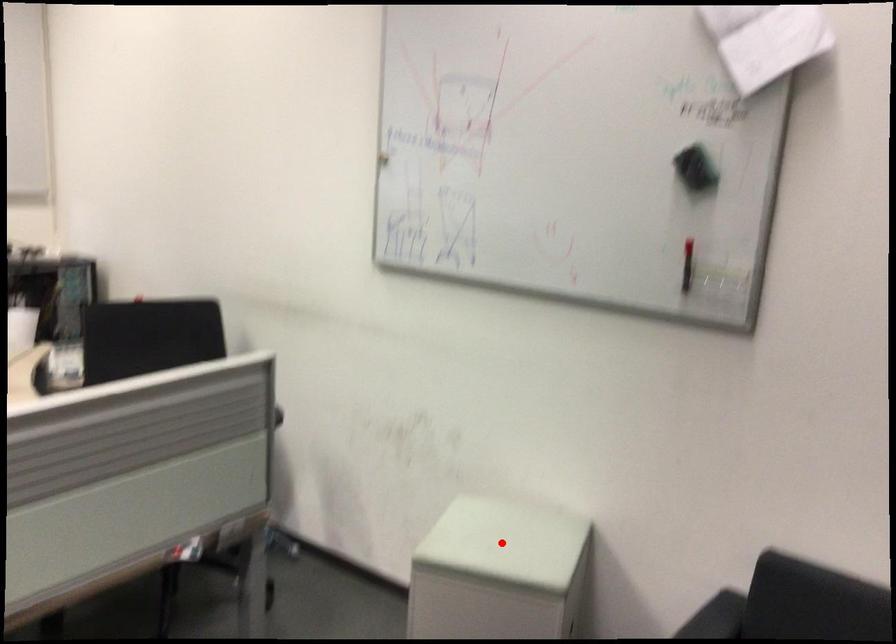
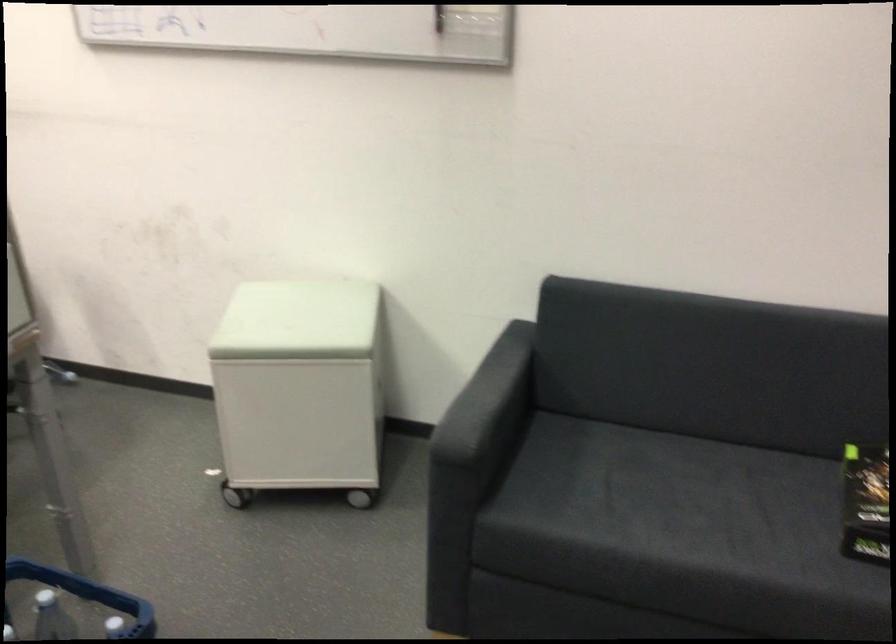
In the second image, find the point that corresponds to the highlighted location in the first image.

(297, 321)